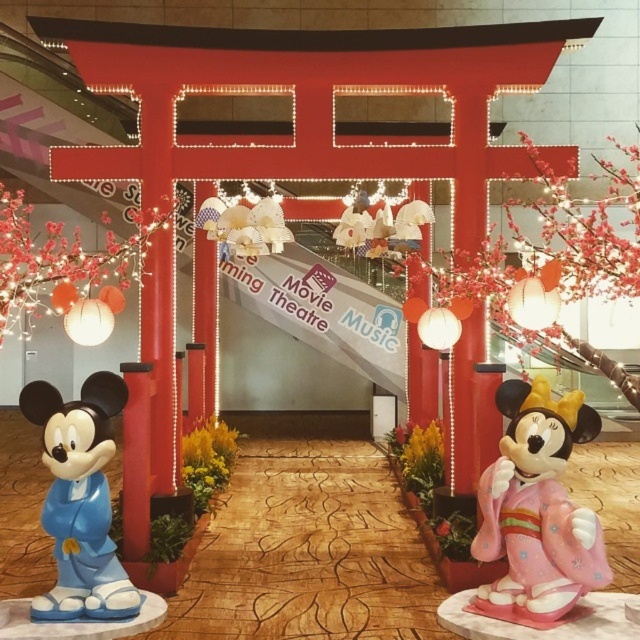
Question: Which point is farther to the camera?

Choices:
 (A) matte blue plastic mickey mouse at left
 (B) pink glossy minnie mouse statue at right

Answer: (A)

Question: Is pink glossy minnie mouse statue at right thinner than matte blue plastic mickey mouse at left?

Choices:
 (A) yes
 (B) no

Answer: (B)

Question: Can you confirm if pink glossy minnie mouse statue at right is smaller than matte blue plastic mickey mouse at left?

Choices:
 (A) yes
 (B) no

Answer: (B)

Question: Is the position of pink glossy minnie mouse statue at right more distant than that of matte blue plastic mickey mouse at left?

Choices:
 (A) no
 (B) yes

Answer: (A)